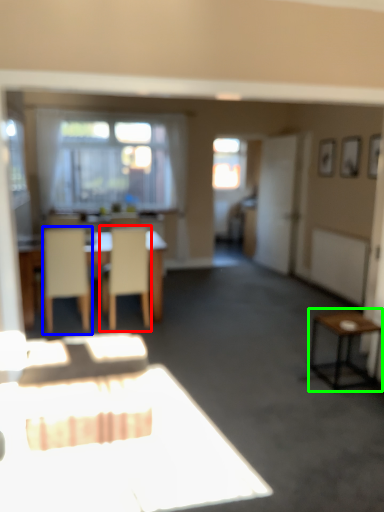
Question: Which object is positioned closest to chair (highlighted by a red box)? Select from chair (highlighted by a blue box) and side table (highlighted by a green box).

Choices:
 (A) chair
 (B) side table

Answer: (A)